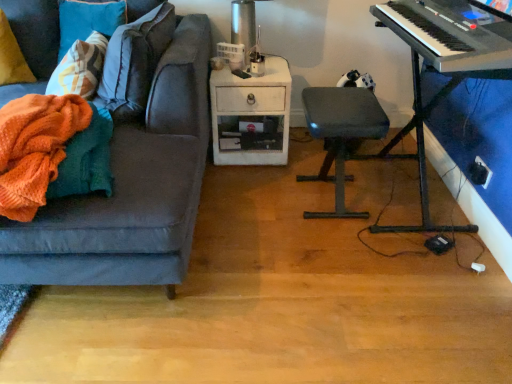
Question: Can you confirm if yellow fabric pillow at left is wider than matte gray stool at center?

Choices:
 (A) yes
 (B) no

Answer: (B)

Question: Considering the relative sizes of yellow fabric pillow at left and matte gray stool at center in the image provided, is yellow fabric pillow at left bigger than matte gray stool at center?

Choices:
 (A) no
 (B) yes

Answer: (A)

Question: Is yellow fabric pillow at left thinner than matte gray stool at center?

Choices:
 (A) yes
 (B) no

Answer: (A)

Question: Is matte gray stool at center located within yellow fabric pillow at left?

Choices:
 (A) yes
 (B) no

Answer: (B)

Question: From the image's perspective, is yellow fabric pillow at left on matte gray stool at center?

Choices:
 (A) yes
 (B) no

Answer: (A)

Question: Is yellow fabric pillow at left at the right side of matte gray stool at center?

Choices:
 (A) yes
 (B) no

Answer: (B)

Question: Is metallic silver table lamp at upper center at the right side of orange knitted blanket at left?

Choices:
 (A) no
 (B) yes

Answer: (B)

Question: From a real-world perspective, is metallic silver table lamp at upper center under orange knitted blanket at left?

Choices:
 (A) no
 (B) yes

Answer: (A)

Question: Is the position of metallic silver table lamp at upper center more distant than that of orange knitted blanket at left?

Choices:
 (A) yes
 (B) no

Answer: (A)

Question: Considering the relative sizes of metallic silver table lamp at upper center and orange knitted blanket at left in the image provided, is metallic silver table lamp at upper center wider than orange knitted blanket at left?

Choices:
 (A) yes
 (B) no

Answer: (A)

Question: From the image's perspective, is metallic silver table lamp at upper center under orange knitted blanket at left?

Choices:
 (A) yes
 (B) no

Answer: (B)

Question: Is metallic silver table lamp at upper center at the left side of orange knitted blanket at left?

Choices:
 (A) no
 (B) yes

Answer: (A)

Question: Is black plastic keyboard at right at the left side of black plastic keyboard at upper right?

Choices:
 (A) no
 (B) yes

Answer: (B)